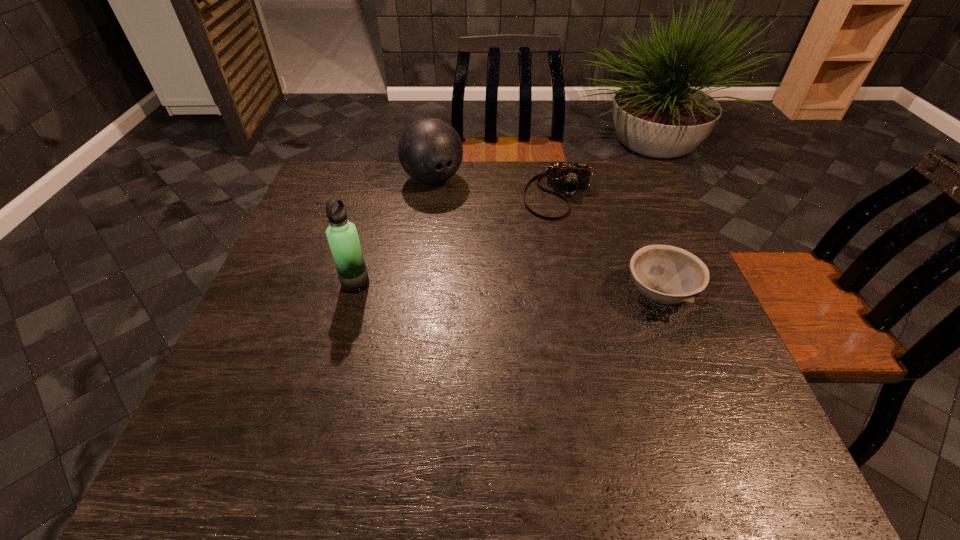
Identify the location of free point between the camera and the leftmost object. This screenshot has height=540, width=960. (457, 240).

Find the location of `free point between the bowl and the shortest object`. free point between the bowl and the shortest object is located at coordinates (609, 245).

Select which object appears as the third closest to the third tallest object. Please provide its 2D coordinates. Your answer should be formatted as a tuple, i.e. [(x, y)], where the tuple contains the x and y coordinates of a point satisfying the conditions above.

[(342, 236)]

Image resolution: width=960 pixels, height=540 pixels. What are the coordinates of `object that is the second closest to the third object from right to left` in the screenshot? It's located at (342, 236).

I want to click on free point that satisfies the following two spatial constraints: 1. on the back side of the tallest object; 2. on the left side of the shortest object, so click(x=380, y=195).

You are a GUI agent. You are given a task and a screenshot of the screen. Output one action in this format:
    pyautogui.click(x=<x>, y=<y>)
    Task: Click on the blank area in the image that satisfies the following two spatial constraints: 1. on the front side of the bowl; 2. on the right side of the third shortest object
    
    Given the screenshot: What is the action you would take?
    pyautogui.click(x=418, y=294)

The height and width of the screenshot is (540, 960). In order to click on free space in the image that satisfies the following two spatial constraints: 1. on the back side of the second object from left to right; 2. on the right side of the tallest object in this screenshot , I will do `click(385, 179)`.

Find the location of a particular element. The image size is (960, 540). free space in the image that satisfies the following two spatial constraints: 1. on the front side of the third tallest object; 2. on the left side of the second object from left to right is located at coordinates (418, 294).

Identify the location of free space that satisfies the following two spatial constraints: 1. on the back side of the camera; 2. on the right side of the tallest object. The image size is (960, 540). (380, 195).